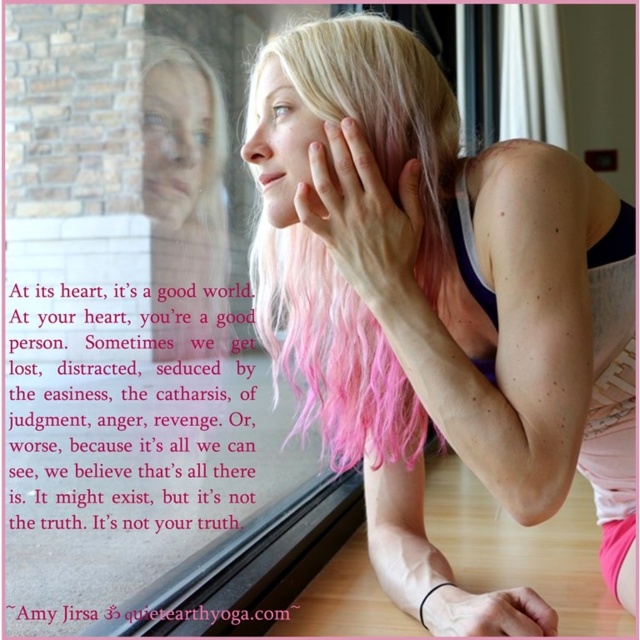
Question: Can you confirm if clear glass window at upper left is smaller than pink matte hand at center?

Choices:
 (A) yes
 (B) no

Answer: (B)

Question: Which object appears closest to the camera in this image?

Choices:
 (A) pink wavy hair at center
 (B) pink matte hand at center
 (C) pink hair at upper center
 (D) pink matte hair at upper center

Answer: (C)

Question: Does pink hair at upper center have a lesser width compared to clear glass window at upper left?

Choices:
 (A) yes
 (B) no

Answer: (B)

Question: Does pink wavy hair at center have a larger size compared to pink matte hand at center?

Choices:
 (A) yes
 (B) no

Answer: (A)

Question: Considering the real-world distances, which object is farthest from the pink matte hand at center?

Choices:
 (A) pink wavy hair at center
 (B) pink matte hair at upper center
 (C) pink hair at upper center
 (D) clear glass window at upper left

Answer: (D)

Question: Which of these objects is positioned closest to the pink matte hair at upper center?

Choices:
 (A) pink hair at upper center
 (B) pink wavy hair at center

Answer: (A)